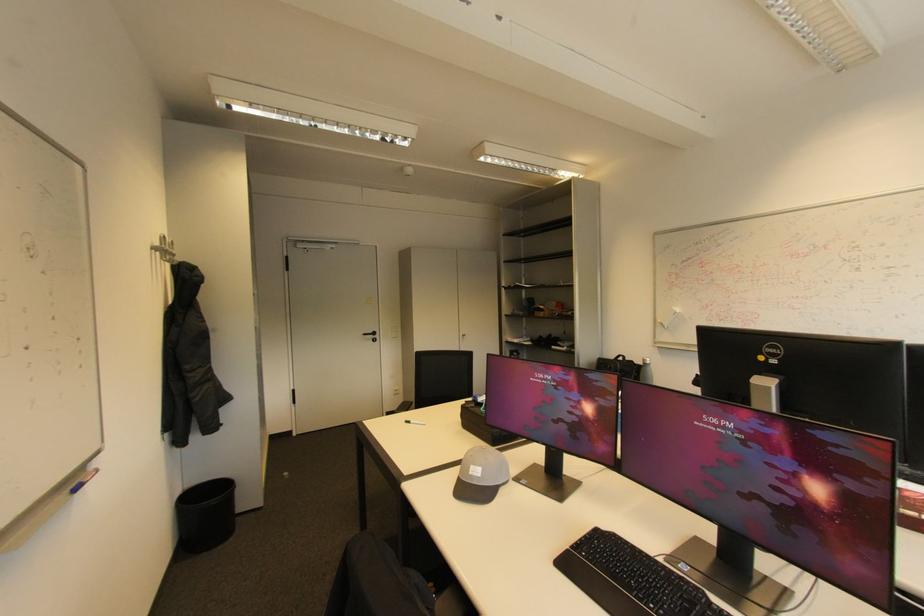
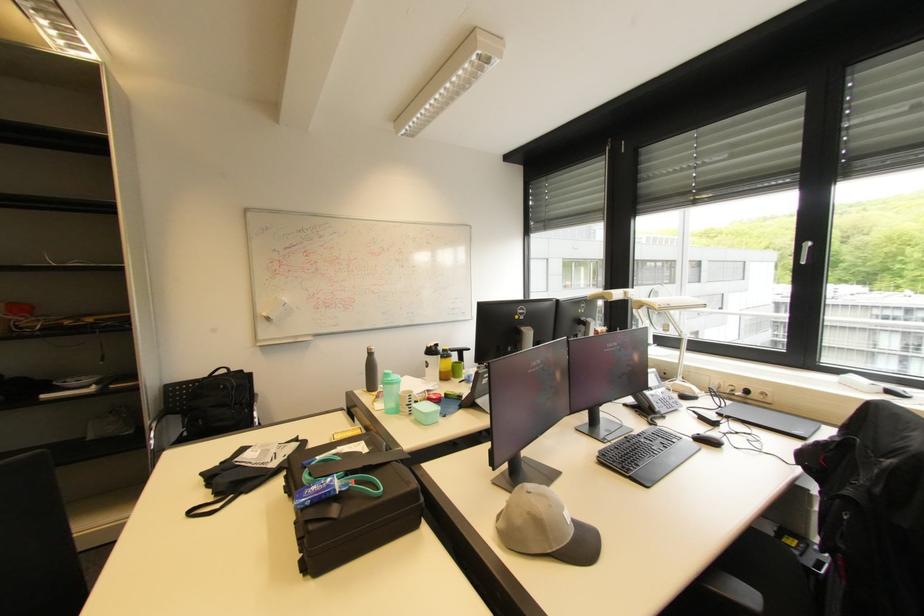
Find the pixel in the second image that matches (x=667, y=325) in the first image.

(273, 320)